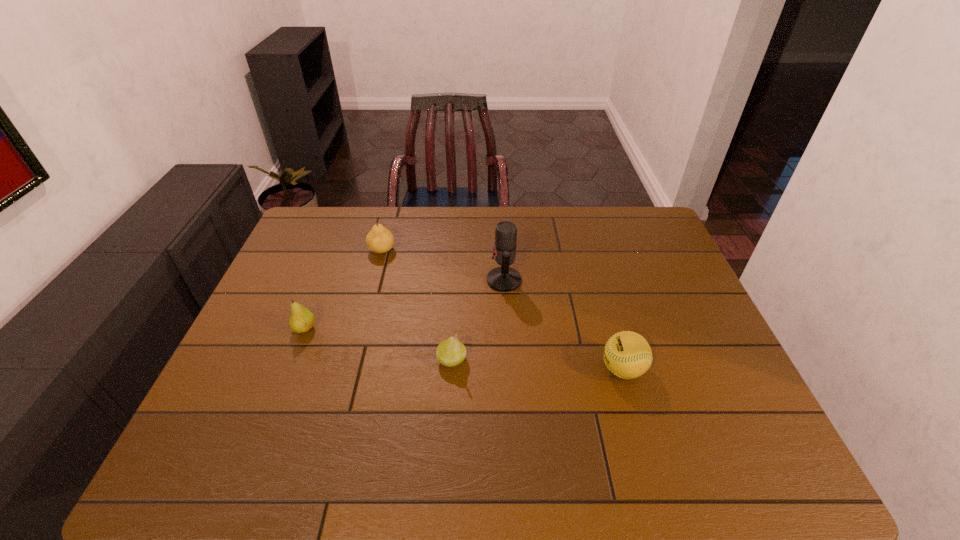
This screenshot has width=960, height=540. In order to click on vacant space situated 0.070m on the side of the microphone with the red ring in this screenshot , I will do (x=464, y=280).

Where is `vacant point located 0.220m on the side of the microphone with the red ring`? The image size is (960, 540). vacant point located 0.220m on the side of the microphone with the red ring is located at coordinates (415, 280).

The image size is (960, 540). Identify the location of vacant space situated 0.300m on the front of the second pear from right to left. (361, 328).

The image size is (960, 540). Identify the location of vacant area located on the right of the leftmost object. (437, 329).

Locate an element on the screen. free space located on the front of the rightmost pear is located at coordinates (445, 462).

Image resolution: width=960 pixels, height=540 pixels. Identify the location of blank space located on the logo side of the softball. (501, 369).

The height and width of the screenshot is (540, 960). In order to click on vacant space positioned on the logo side of the softball in this screenshot , I will do `click(580, 369)`.

Where is `free space located on the logo side of the softball`? free space located on the logo side of the softball is located at coordinates (520, 369).

Where is `object that is positioned at the far edge`? This screenshot has width=960, height=540. object that is positioned at the far edge is located at coordinates (379, 240).

Locate an element on the screen. object located at the left edge is located at coordinates (301, 320).